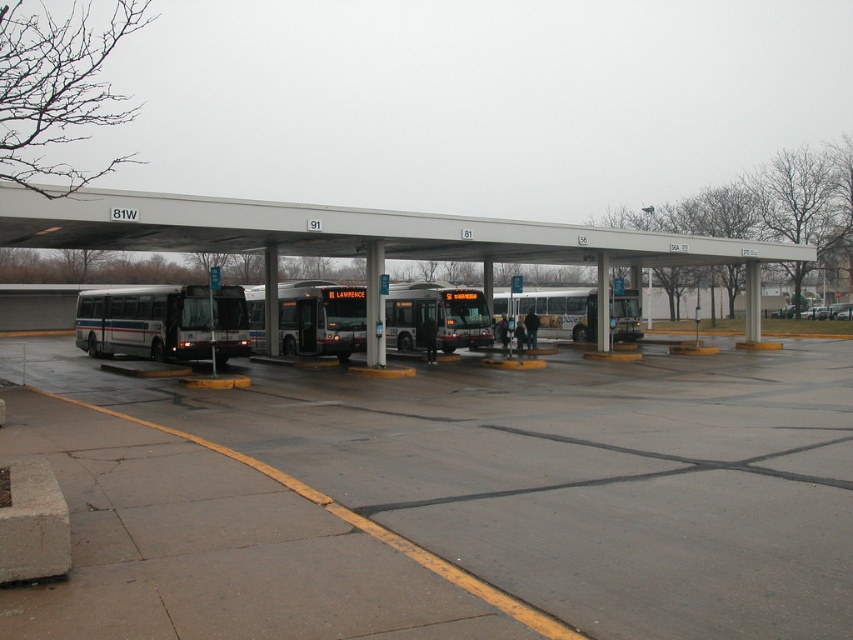
Question: Among these points, which one is nearest to the camera?

Choices:
 (A) (222, 337)
 (B) (624, 298)

Answer: (A)

Question: Which of the following is the farthest from the observer?

Choices:
 (A) matte black bus at left
 (B) white metallic bus at center
 (C) concrete parking lot at center

Answer: (B)

Question: Is concrete parking lot at center wider than white metallic bus at center?

Choices:
 (A) yes
 (B) no

Answer: (A)

Question: Considering the relative positions of matte black bus at left and white metallic bus at center in the image provided, where is matte black bus at left located with respect to white metallic bus at center?

Choices:
 (A) right
 (B) left

Answer: (B)

Question: Does concrete parking lot at center have a lesser width compared to matte black bus at left?

Choices:
 (A) no
 (B) yes

Answer: (A)

Question: Which object is the farthest from the concrete parking lot at center?

Choices:
 (A) white metallic bus at center
 (B) matte black bus at left

Answer: (A)